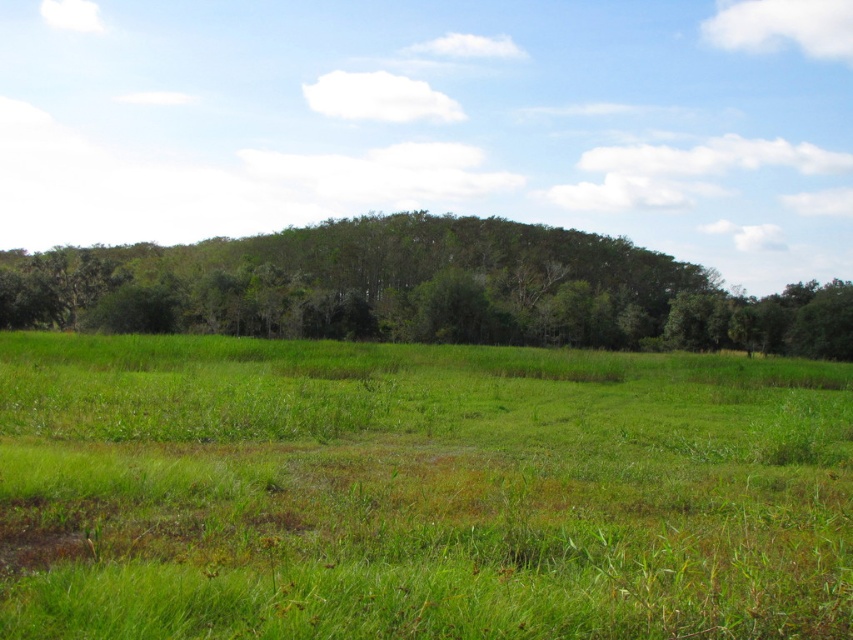
Is green grassy pasture at center below green leafy trees at center?

Yes, green grassy pasture at center is below green leafy trees at center.

Who is taller, green grassy pasture at center or green leafy trees at center?

→ With more height is green leafy trees at center.

Does point (410, 406) lie in front of point (425, 225)?

That is True.

Find the location of a particular element. green grassy pasture at center is located at coordinates (418, 490).